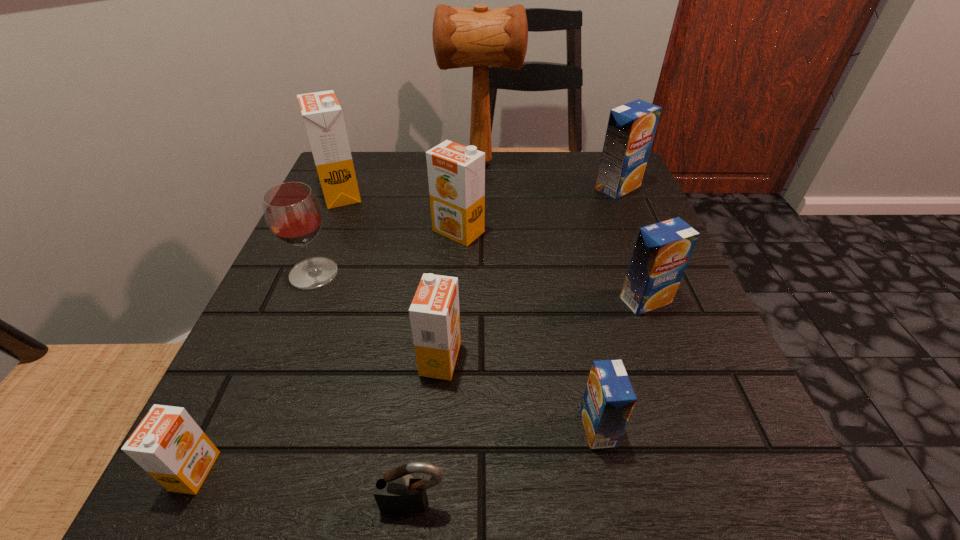
In order to click on the third farthest orange orange juice in this screenshot , I will do `click(434, 313)`.

The height and width of the screenshot is (540, 960). Identify the location of the seventh farthest object. (434, 313).

Locate an element on the screen. This screenshot has height=540, width=960. the nearest blue orange_juice is located at coordinates click(609, 398).

Identify the location of the fifth orange juice from left to right. (609, 398).

Identify the location of the smallest orange orange juice. The height and width of the screenshot is (540, 960). (168, 444).

Image resolution: width=960 pixels, height=540 pixels. Find the location of `padlock`. padlock is located at coordinates pyautogui.click(x=398, y=491).

Where is `free spot located 0.050m on the strike surface of the mallet`? The width and height of the screenshot is (960, 540). free spot located 0.050m on the strike surface of the mallet is located at coordinates (420, 163).

Where is `vacant space situated 0.260m on the strike surface of the mallet`? This screenshot has width=960, height=540. vacant space situated 0.260m on the strike surface of the mallet is located at coordinates (333, 163).

Identify the location of free space located 0.070m on the strike surface of the mallet. The width and height of the screenshot is (960, 540). (412, 163).

You are a GUI agent. You are given a task and a screenshot of the screen. Output one action in this format:
    pyautogui.click(x=<x>, y=<y>)
    Task: Click on the vacant space positioned on the front of the biggest orange orange juice
    The height and width of the screenshot is (540, 960).
    Given the screenshot: What is the action you would take?
    pyautogui.click(x=321, y=242)